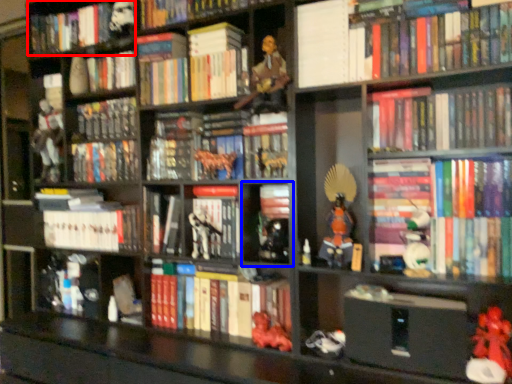
Question: Which object is closer to the camera taking this photo, book (highlighted by a red box) or cabinet (highlighted by a blue box)?

Choices:
 (A) book
 (B) cabinet

Answer: (B)